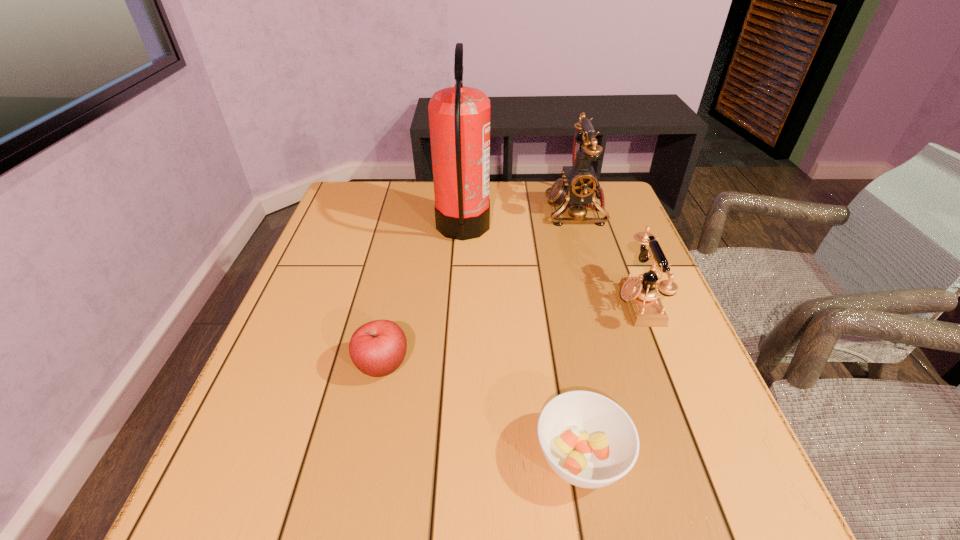
Identify the location of free point located on the front side of the fire extinguisher. (548, 228).

Find the location of a particular element. The image size is (960, 540). vacant space located on the front of the taller telephone, featuring the rotary dial is located at coordinates (438, 210).

The height and width of the screenshot is (540, 960). In order to click on vacant space located 0.360m on the front of the taller telephone, featuring the rotary dial in this screenshot , I will do `click(420, 210)`.

The width and height of the screenshot is (960, 540). In order to click on vacant space located on the front of the taller telephone, featuring the rotary dial in this screenshot , I will do `click(463, 210)`.

Find the location of a particular element. The height and width of the screenshot is (540, 960). vacant space situated 0.280m on the dial of the nearer telephone is located at coordinates (492, 303).

Where is `free space located 0.210m on the dial of the nearer telephone`? The height and width of the screenshot is (540, 960). free space located 0.210m on the dial of the nearer telephone is located at coordinates (523, 303).

Where is `vacant space located on the dial of the nearer telephone`? The image size is (960, 540). vacant space located on the dial of the nearer telephone is located at coordinates (528, 303).

Locate an element on the screen. The height and width of the screenshot is (540, 960). vacant space situated on the back of the second shortest object is located at coordinates (403, 264).

Image resolution: width=960 pixels, height=540 pixels. In order to click on free region located 0.240m on the left of the soup bowl in this screenshot , I will do `click(385, 457)`.

Locate an element on the screen. Image resolution: width=960 pixels, height=540 pixels. fire extinguisher present at the far edge is located at coordinates (459, 117).